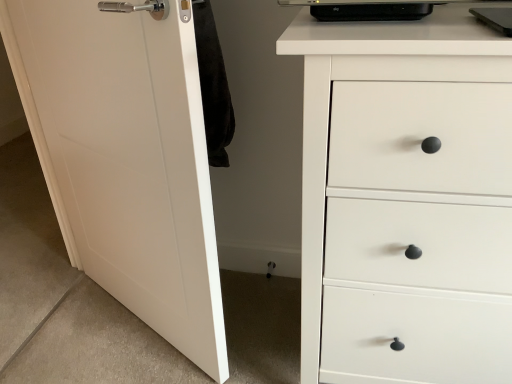
Question: Does white matte door at left come in front of white matte chest of drawers at right?

Choices:
 (A) no
 (B) yes

Answer: (A)

Question: From the image's perspective, is white matte door at left located beneath white matte chest of drawers at right?

Choices:
 (A) yes
 (B) no

Answer: (B)

Question: Can you confirm if white matte door at left is shorter than white matte chest of drawers at right?

Choices:
 (A) yes
 (B) no

Answer: (B)

Question: Is white matte door at left located outside white matte chest of drawers at right?

Choices:
 (A) yes
 (B) no

Answer: (A)

Question: Does white matte door at left come behind white matte chest of drawers at right?

Choices:
 (A) no
 (B) yes

Answer: (B)

Question: Could you tell me if white matte door at left is facing white matte chest of drawers at right?

Choices:
 (A) no
 (B) yes

Answer: (A)

Question: Is the surface of white matte chest of drawers at right in direct contact with white matte door at left?

Choices:
 (A) yes
 (B) no

Answer: (B)

Question: Can you confirm if white matte chest of drawers at right is bigger than white matte door at left?

Choices:
 (A) yes
 (B) no

Answer: (A)

Question: Does white matte chest of drawers at right have a lesser height compared to white matte door at left?

Choices:
 (A) yes
 (B) no

Answer: (A)

Question: From a real-world perspective, is white matte chest of drawers at right beneath white matte door at left?

Choices:
 (A) yes
 (B) no

Answer: (A)

Question: Is white matte chest of drawers at right to the left of white matte door at left from the viewer's perspective?

Choices:
 (A) no
 (B) yes

Answer: (A)

Question: Is white matte chest of drawers at right thinner than white matte door at left?

Choices:
 (A) yes
 (B) no

Answer: (B)

Question: Does point pyautogui.click(x=79, y=254) appear closer or farther from the camera than point pyautogui.click(x=408, y=311)?

Choices:
 (A) farther
 (B) closer

Answer: (A)